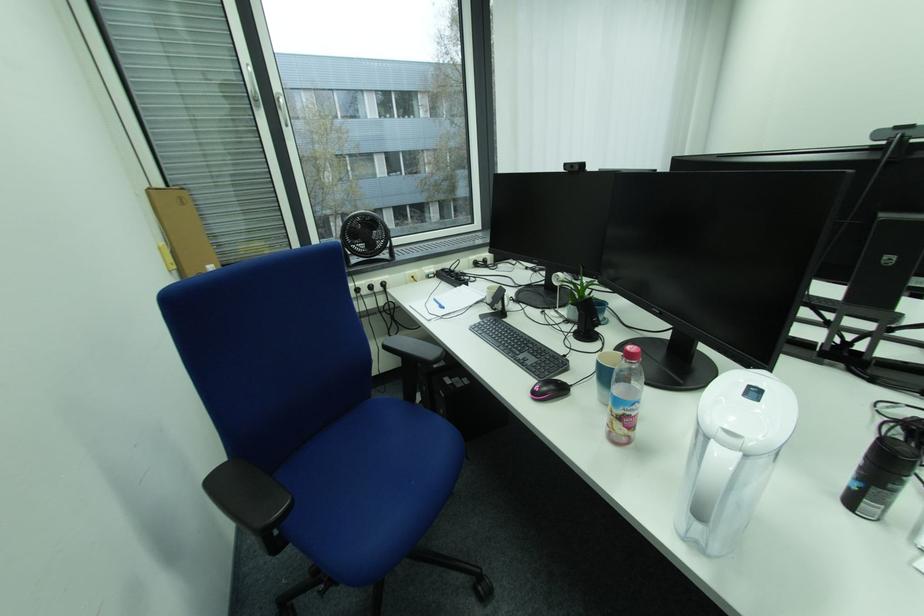
Where would you turn the white window handle? Please return your answer as a coordinate pair (x, y).

(251, 84)